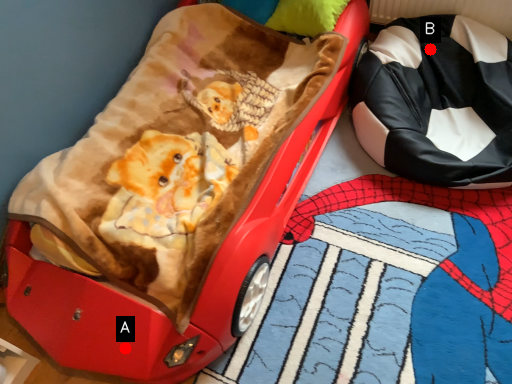
Question: Two points are circled on the image, labeled by A and B beside each circle. Which point appears closest to the camera in this image?

Choices:
 (A) A is closer
 (B) B is closer

Answer: (A)